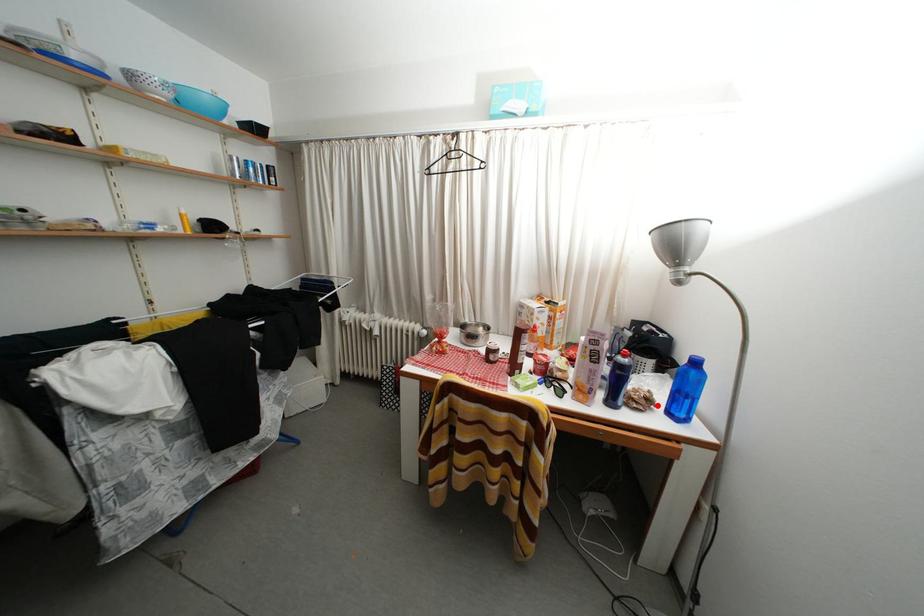
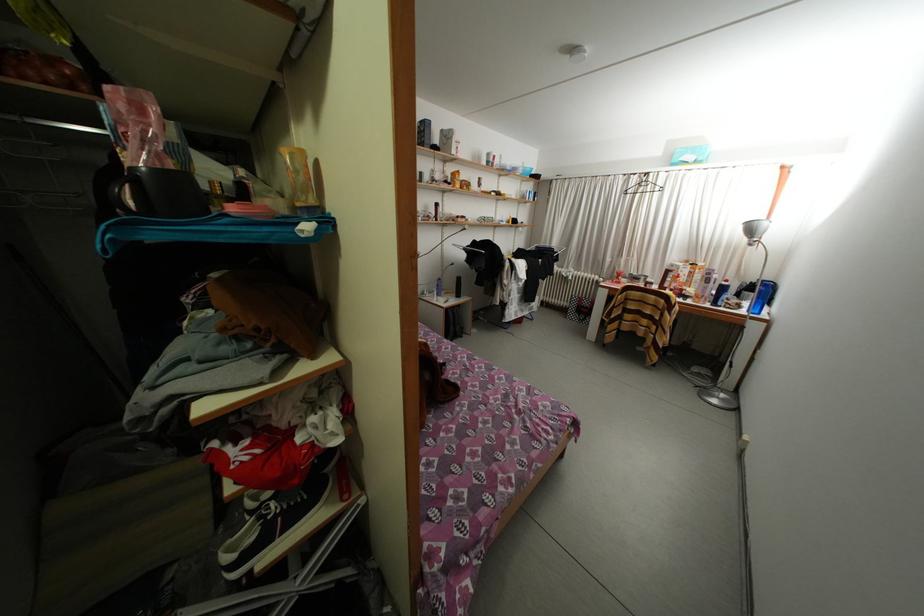
Find the pixel in the second image that matches the highlighted location in the first image.

(747, 310)